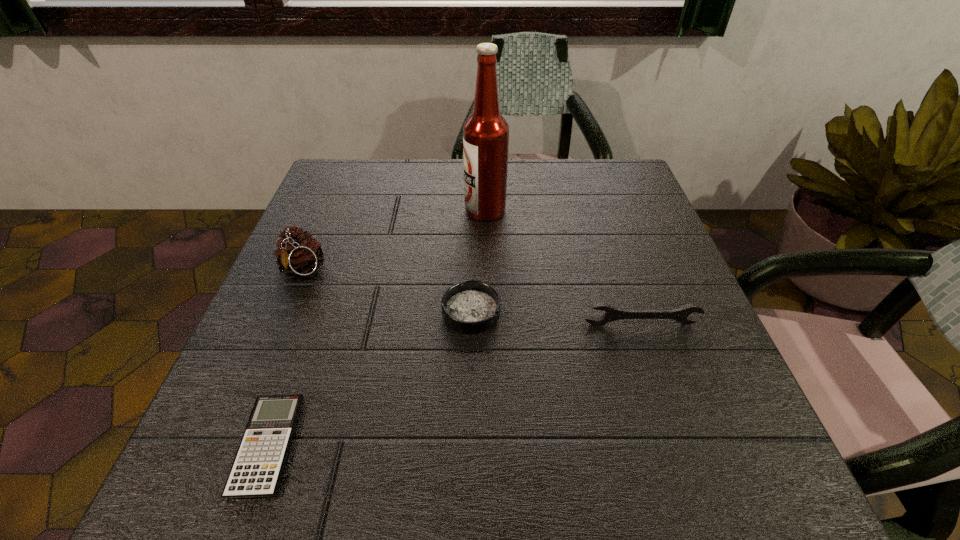
I want to click on empty location between the ashtray and the fourth shortest object, so click(x=387, y=292).

Identify the location of empty location between the shortest object and the fourth tallest object. The width and height of the screenshot is (960, 540). (370, 379).

Identify the location of free space between the third tallest object and the alcohol. The image size is (960, 540). (563, 267).

Where is `empty space between the farthest object and the fourth tallest object`? The height and width of the screenshot is (540, 960). empty space between the farthest object and the fourth tallest object is located at coordinates (478, 261).

The width and height of the screenshot is (960, 540). I want to click on free space between the pinecone and the farthest object, so click(394, 241).

Select which object is the second closest to the third tallest object. Please provide its 2D coordinates. Your answer should be formatted as a tuple, i.e. [(x, y)], where the tuple contains the x and y coordinates of a point satisfying the conditions above.

[(485, 133)]

Image resolution: width=960 pixels, height=540 pixels. What are the coordinates of `object that stands as the third closest to the farthest object` in the screenshot? It's located at (681, 315).

What are the coordinates of `free space that satisfies the following two spatial constraints: 1. on the label side of the farthest object; 2. with a leaf charm attached to the fourth shortest object` in the screenshot? It's located at (486, 271).

Locate an element on the screen. The width and height of the screenshot is (960, 540). vacant area that satisfies the following two spatial constraints: 1. with a leaf charm attached to the second tallest object; 2. on the right side of the fourth tallest object is located at coordinates (285, 312).